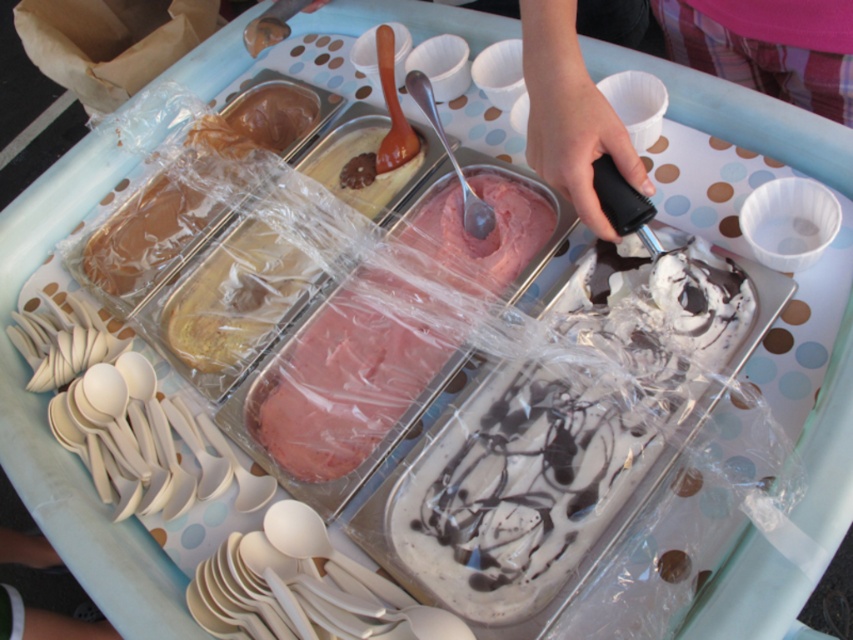
Question: Among these points, which one is farthest from the camera?

Choices:
 (A) coord(238,355)
 (B) coord(515,520)
 (C) coord(575,129)
 (D) coord(351,468)

Answer: (A)

Question: Is yellow matte ice cream at center to the right of smooth black ice cream scoop at center from the viewer's perspective?

Choices:
 (A) no
 (B) yes

Answer: (A)

Question: Which of the following is the farthest from the observer?

Choices:
 (A) (451, 260)
 (B) (144, 227)

Answer: (B)

Question: Is yellow matte ice cream at center above smooth chocolate ice cream at left?

Choices:
 (A) no
 (B) yes

Answer: (A)

Question: Estimate the real-world distances between objects in this image. Which object is farther from the white chocolate ice cream at center?

Choices:
 (A) yellow matte ice cream at center
 (B) smooth black ice cream scoop at center

Answer: (A)

Question: Is white chocolate ice cream at center to the right of smooth black ice cream scoop at center from the viewer's perspective?

Choices:
 (A) no
 (B) yes

Answer: (A)